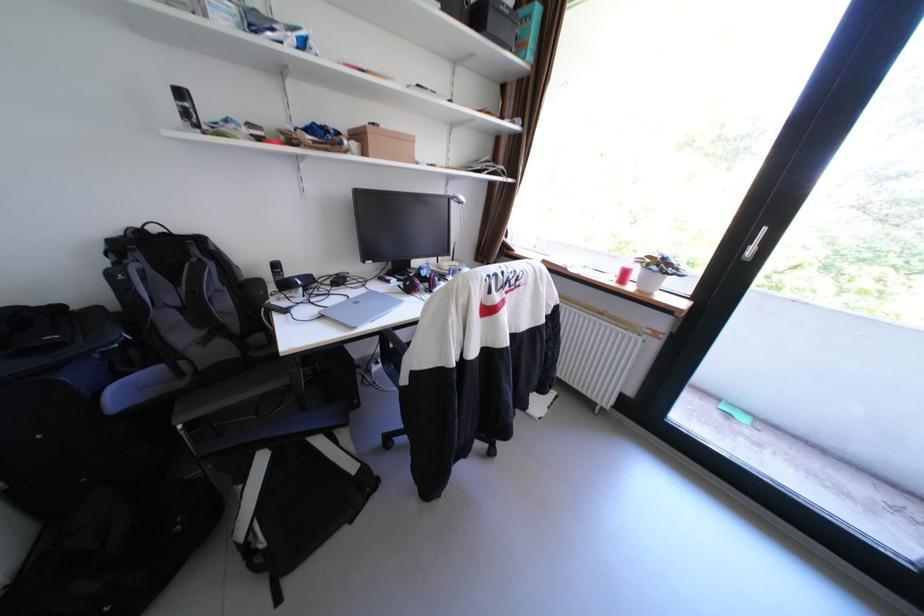
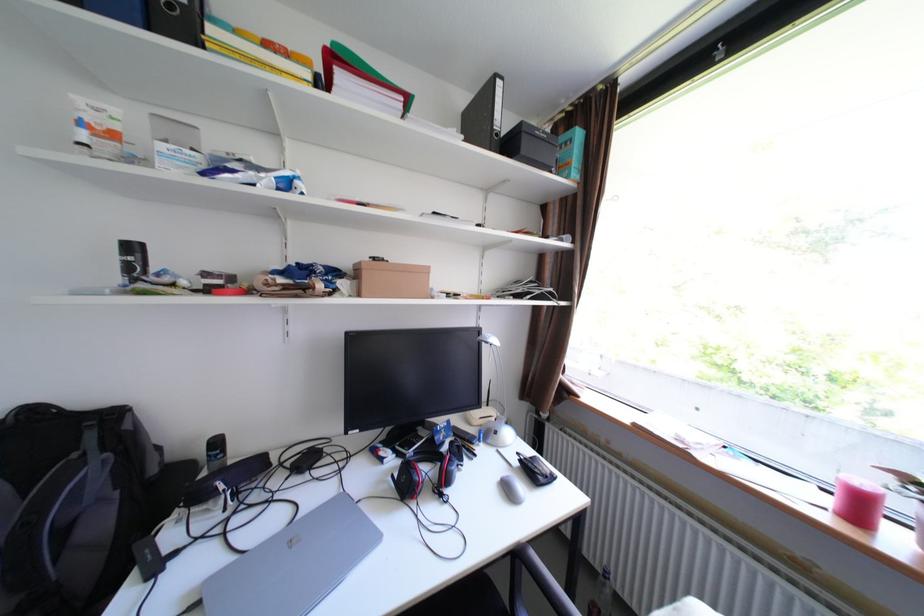
Find the pixel in the second image that matches point (638, 265) in the first image.

(874, 484)